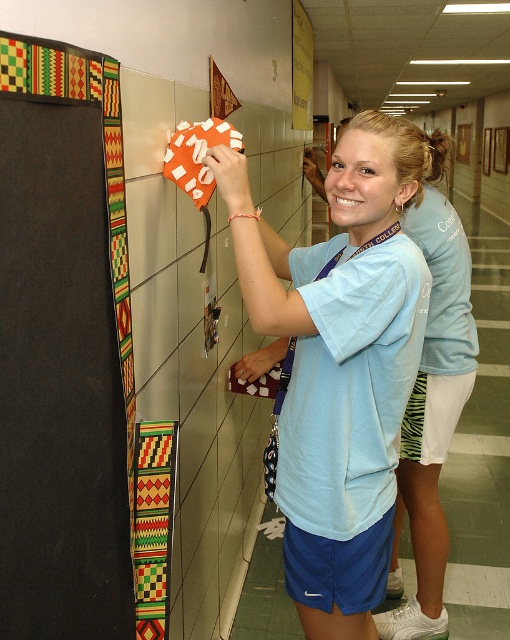
Question: Which of the following is the closest to the observer?

Choices:
 (A) (391, 461)
 (B) (391, 276)
 (C) (51, 564)

Answer: (C)

Question: Is light blue fabric scrub at center closer to the viewer compared to matte blue shirt at center?

Choices:
 (A) no
 (B) yes

Answer: (B)

Question: Does black fabric at left have a smaller size compared to matte blue shirt at center?

Choices:
 (A) yes
 (B) no

Answer: (A)

Question: Which point is closer to the camera?

Choices:
 (A) (309, 490)
 (B) (53, 90)
 (C) (405, 134)

Answer: (B)

Question: Does black fabric at left have a greater width compared to matte blue shirt at center?

Choices:
 (A) no
 (B) yes

Answer: (A)

Question: Which point is farther to the camera?

Choices:
 (A) light blue fabric scrub at center
 (B) matte blue shirt at center

Answer: (B)